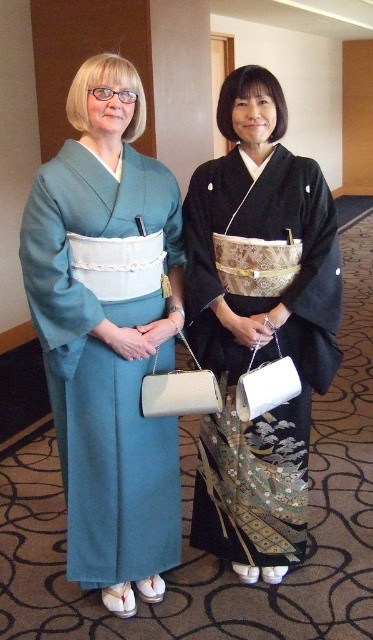
Between point (91, 333) and point (202, 490), which one is positioned behind?

Point (202, 490)

Who is more forward, (126, 106) or (255, 170)?

Point (126, 106) is more forward.

Describe the element at coordinates (108, 333) in the screenshot. I see `teal silk kimono at left` at that location.

Locate an element on the screen. teal silk kimono at left is located at coordinates click(108, 333).